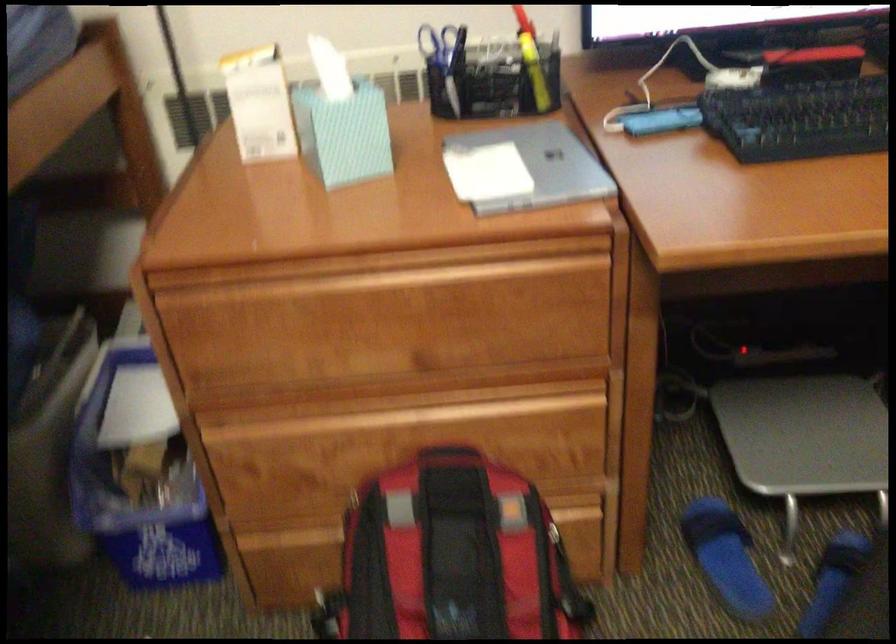
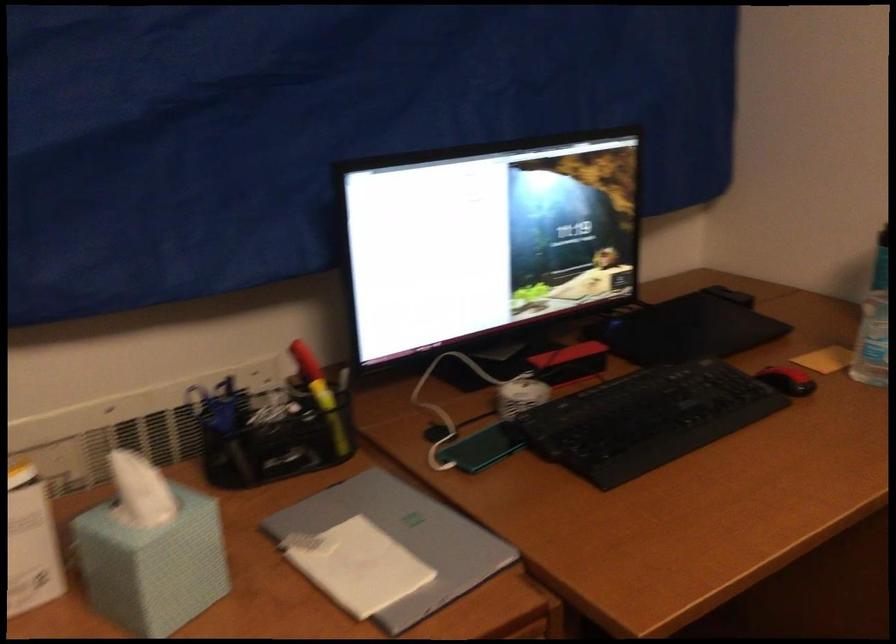
Question: How did the camera likely rotate?

Choices:
 (A) Left
 (B) Right
 (C) Up
 (D) Down

Answer: (B)